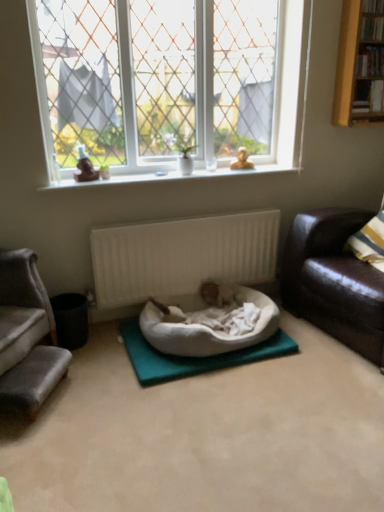
Question: Does black matte trash bin at lower left appear on the right side of velvet grey couch at left, which is the first studio couch from left to right?

Choices:
 (A) yes
 (B) no

Answer: (A)

Question: From the image's perspective, is black matte trash bin at lower left located beneath velvet grey couch at left, which is the second studio couch from right to left?

Choices:
 (A) yes
 (B) no

Answer: (A)

Question: Can you confirm if black matte trash bin at lower left is shorter than velvet grey couch at left, which is the first studio couch from left to right?

Choices:
 (A) yes
 (B) no

Answer: (A)

Question: From a real-world perspective, does black matte trash bin at lower left stand above velvet grey couch at left, which is the first studio couch from left to right?

Choices:
 (A) no
 (B) yes

Answer: (A)

Question: Does black matte trash bin at lower left turn towards velvet grey couch at left, which is the first studio couch from left to right?

Choices:
 (A) yes
 (B) no

Answer: (B)

Question: Is point (135, 23) positioned closer to the camera than point (183, 348)?

Choices:
 (A) farther
 (B) closer

Answer: (A)

Question: From the image's perspective, is clear glass window at upper center located above or below white soft dog bed at center?

Choices:
 (A) above
 (B) below

Answer: (A)

Question: Based on their sizes in the image, would you say clear glass window at upper center is bigger or smaller than white soft dog bed at center?

Choices:
 (A) small
 (B) big

Answer: (B)

Question: Would you say clear glass window at upper center is to the left or to the right of white soft dog bed at center in the picture?

Choices:
 (A) left
 (B) right

Answer: (A)

Question: In terms of size, does white soft dog bed at center appear bigger or smaller than yellow wood bookshelf at upper right?

Choices:
 (A) small
 (B) big

Answer: (B)

Question: From a real-world perspective, relative to yellow wood bookshelf at upper right, is white soft dog bed at center vertically above or below?

Choices:
 (A) below
 (B) above

Answer: (A)

Question: In the image, is white soft dog bed at center positioned in front of or behind yellow wood bookshelf at upper right?

Choices:
 (A) behind
 (B) front

Answer: (B)

Question: From the image's perspective, relative to yellow wood bookshelf at upper right, is white soft dog bed at center above or below?

Choices:
 (A) above
 (B) below

Answer: (B)

Question: Is white soft dog bed at center in front of or behind black matte trash bin at lower left in the image?

Choices:
 (A) behind
 (B) front

Answer: (B)

Question: Considering the relative positions of white soft dog bed at center and black matte trash bin at lower left in the image provided, is white soft dog bed at center to the left or to the right of black matte trash bin at lower left?

Choices:
 (A) right
 (B) left

Answer: (A)